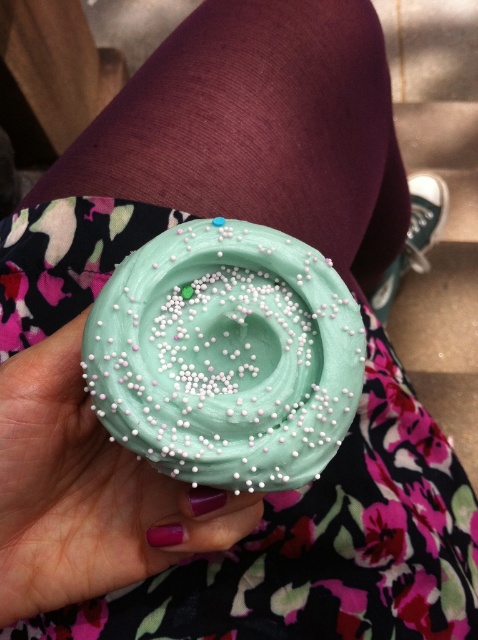
Question: Which point appears farthest from the camera in this image?

Choices:
 (A) (214, 512)
 (B) (207, 458)

Answer: (A)

Question: Does teal frosting cupcake at center appear on the left side of matte teal cupcake at center?

Choices:
 (A) yes
 (B) no

Answer: (B)

Question: From the image, what is the correct spatial relationship of teal frosting cupcake at center in relation to matte teal cupcake at center?

Choices:
 (A) left
 (B) right

Answer: (B)

Question: Can you confirm if teal frosting cupcake at center is bigger than matte teal cupcake at center?

Choices:
 (A) yes
 (B) no

Answer: (B)

Question: Which point appears closest to the camera in this image?

Choices:
 (A) (108, 504)
 (B) (108, 420)

Answer: (B)